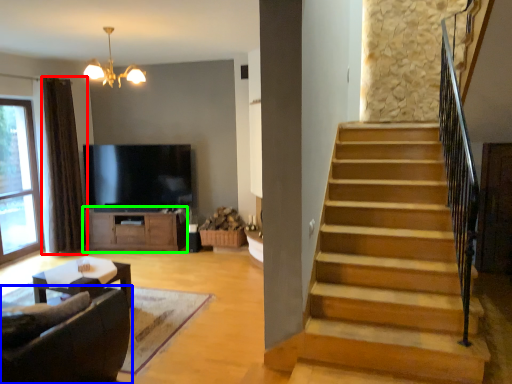
Question: Which object is positioned closest to curtain (highlighted by a red box)? Select from studio couch (highlighted by a blue box) and cabinetry (highlighted by a green box).

Choices:
 (A) studio couch
 (B) cabinetry

Answer: (B)